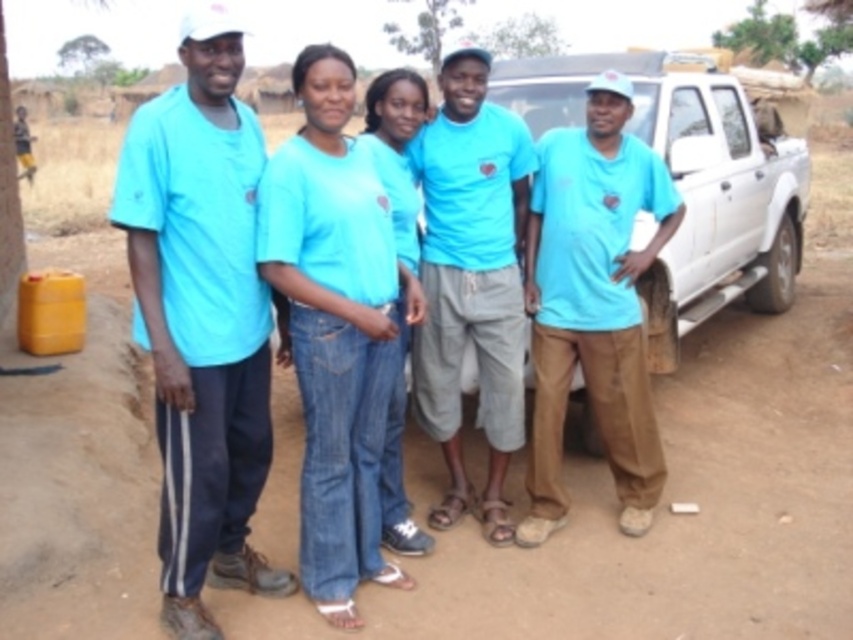
You are a photographer trying to capture a group photo of the matte blue shirt at left and the matte blue shirt at center. Which person should you ask to stand on a small stool to make them appear taller in the photo?

The matte blue shirt at left has a lesser height compared to matte blue shirt at center, so you should ask the person wearing the matte blue shirt at left to stand on a small stool to make them appear taller in the photo.

You are standing in the rural setting shown in the image. You need to find the matte blue shirt at left. Where would you look relative to the group of five individuals?

The matte blue shirt at left is located at the point with coordinates 0.495 on the x axis and 0.237 on the y axis relative to the image frame.